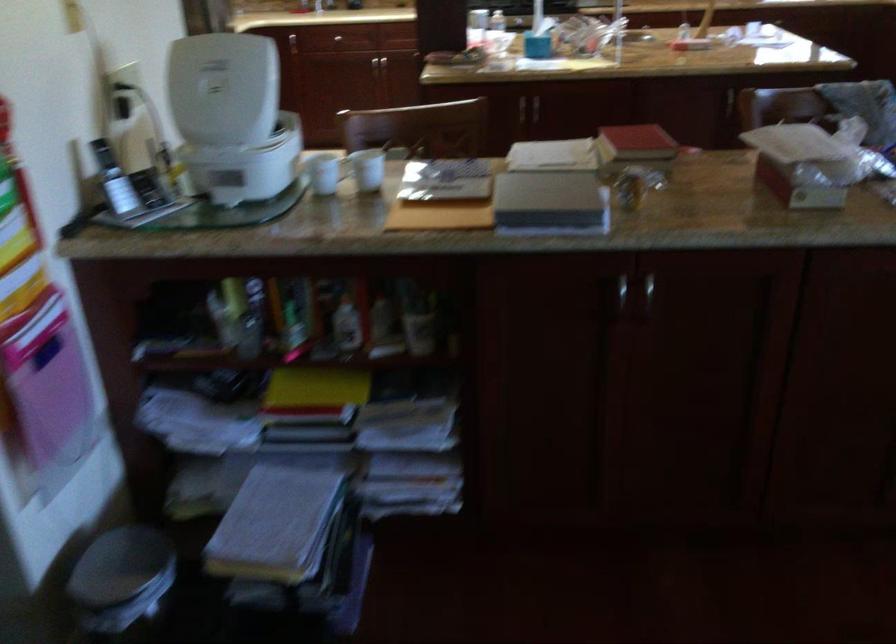
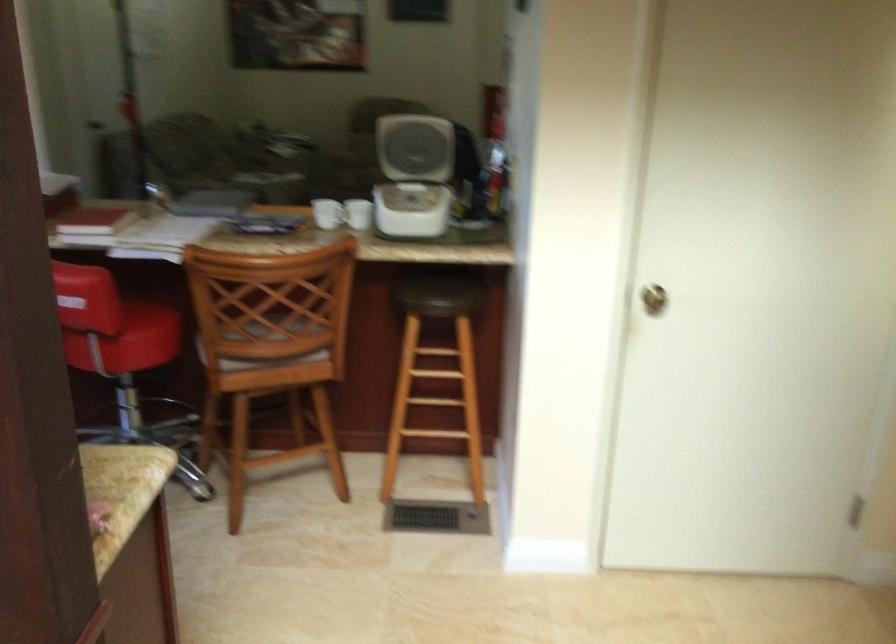
The point at (368, 182) is marked in the first image. Where is the corresponding point in the second image?

(326, 214)